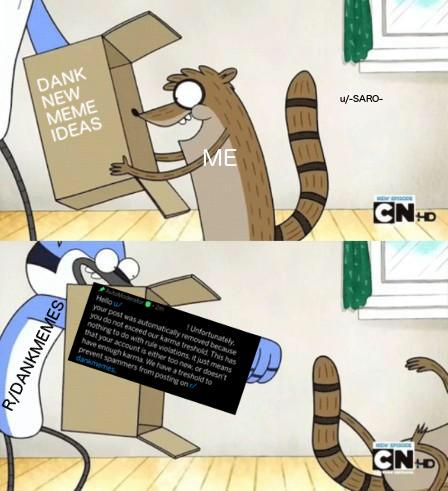
Where is `window pane`? window pane is located at coordinates (426, 16), (419, 258).